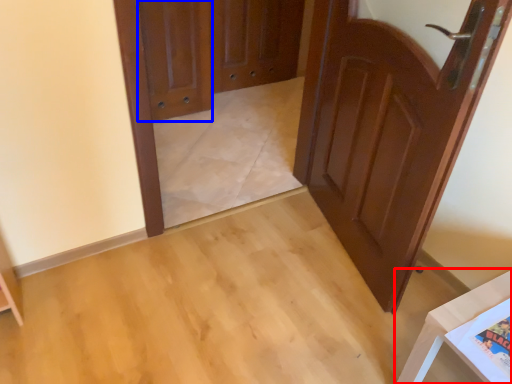
Question: Among these objects, which one is farthest to the camera, furniture (highlighted by a red box) or door (highlighted by a blue box)?

Choices:
 (A) furniture
 (B) door

Answer: (B)